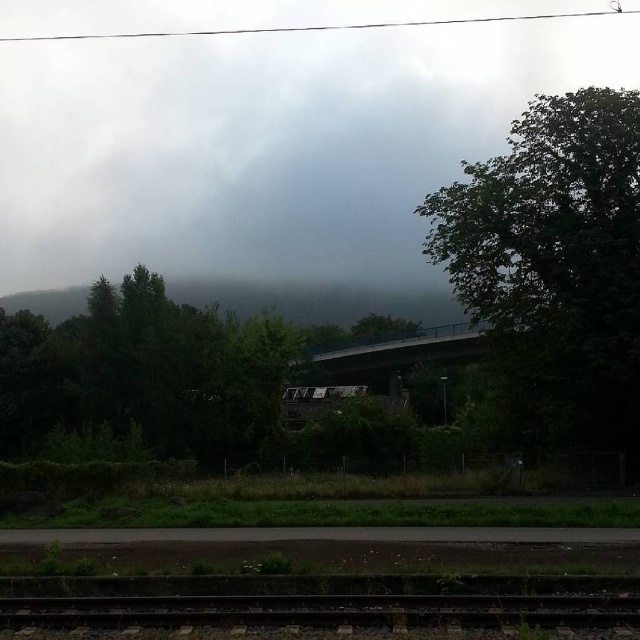
You are a landscape photographer trying to capture the green leafy tree at upper right and the green leafy tree at center in a single frame. Which tree should you focus on to ensure both are visible without zooming in too much?

The green leafy tree at upper right is wider than the green leafy tree at center, so focusing on the green leafy tree at upper right would allow both trees to be captured in the frame without excessive zooming.

You are standing at the center of the image. Which direction should you walk to reach the smooth concrete train track at bottom?

The smooth concrete train track at bottom is located at point [324,611], which is to the bottom of the image. Therefore, you should walk downward to reach it.

You are standing at the railway track in the foreground and want to walk towards the green leafy tree at upper right and the green leafy tree at center. Which tree will you encounter first?

The green leafy tree at upper right is closer to you than the green leafy tree at center, so you will encounter the green leafy tree at upper right first.